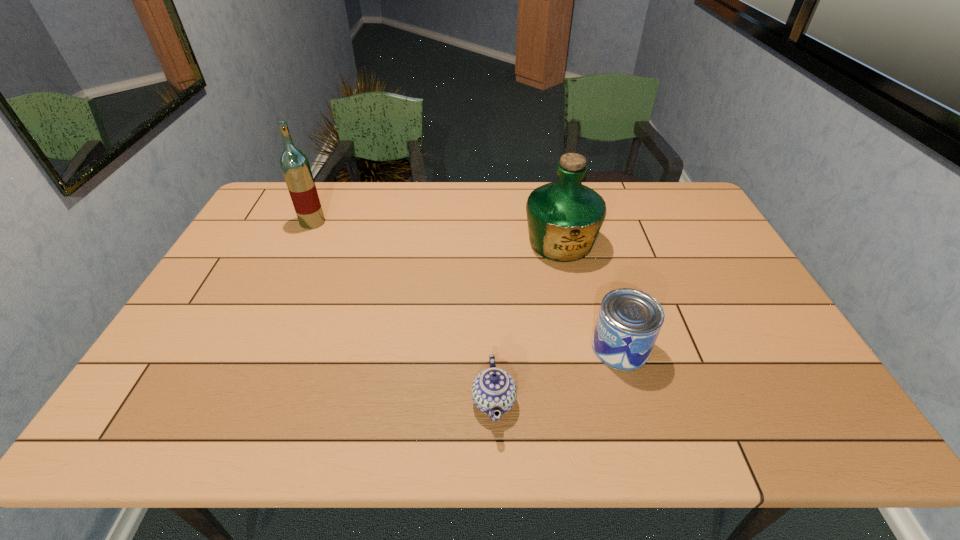
At what (x,y) coordinates should I click in order to perform the action: click on free point between the right liquor and the left liquor. Please return your answer as a coordinate pair (x, y). Image resolution: width=960 pixels, height=540 pixels. Looking at the image, I should click on (437, 233).

Where is `vacant region between the third shortest object and the shortest object`? The width and height of the screenshot is (960, 540). vacant region between the third shortest object and the shortest object is located at coordinates (527, 322).

Locate which object ranks second in proximity to the right liquor. Please provide its 2D coordinates. Your answer should be formatted as a tuple, i.e. [(x, y)], where the tuple contains the x and y coordinates of a point satisfying the conditions above.

[(493, 389)]

Identify the location of object that can be found as the third closest to the shorter liquor. The image size is (960, 540). (295, 166).

At what (x,y) coordinates should I click in order to perform the action: click on free space that satisfies the following two spatial constraints: 1. on the label side of the shorter liquor; 2. at the spout of the shortest object. Please return your answer as a coordinate pair (x, y). Looking at the image, I should click on (594, 401).

Locate an element on the screen. free space that satisfies the following two spatial constraints: 1. on the label side of the second tallest object; 2. at the spout of the shortest object is located at coordinates (594, 401).